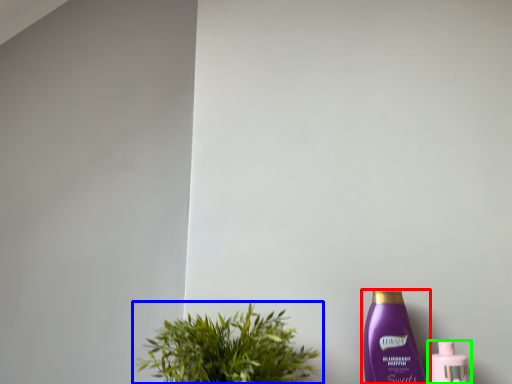
Question: Based on their relative distances, which object is nearer to bottle (highlighted by a red box)? Choose from houseplant (highlighted by a blue box) and bottle (highlighted by a green box).

Choices:
 (A) houseplant
 (B) bottle

Answer: (B)